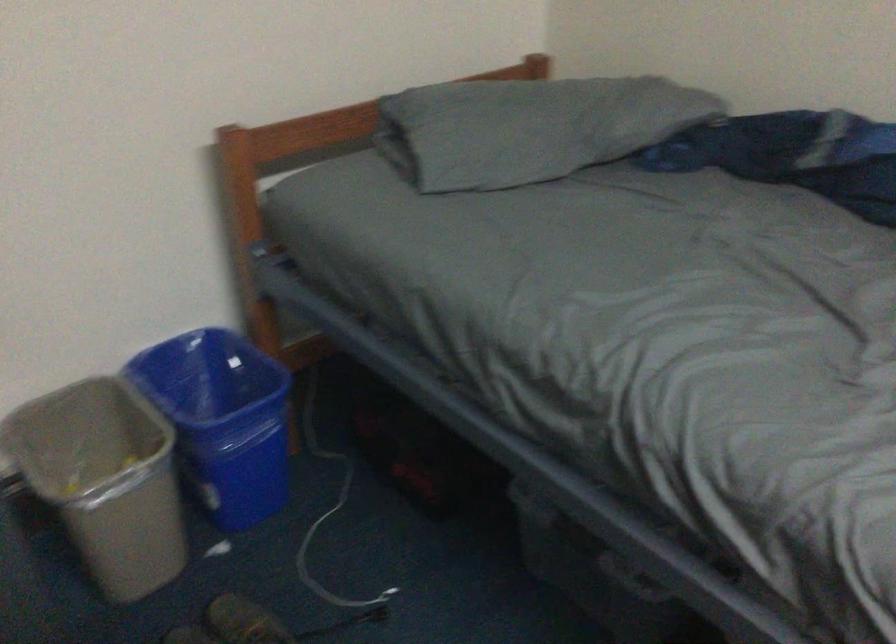
Where is `blue trash can`? blue trash can is located at coordinates (221, 420).